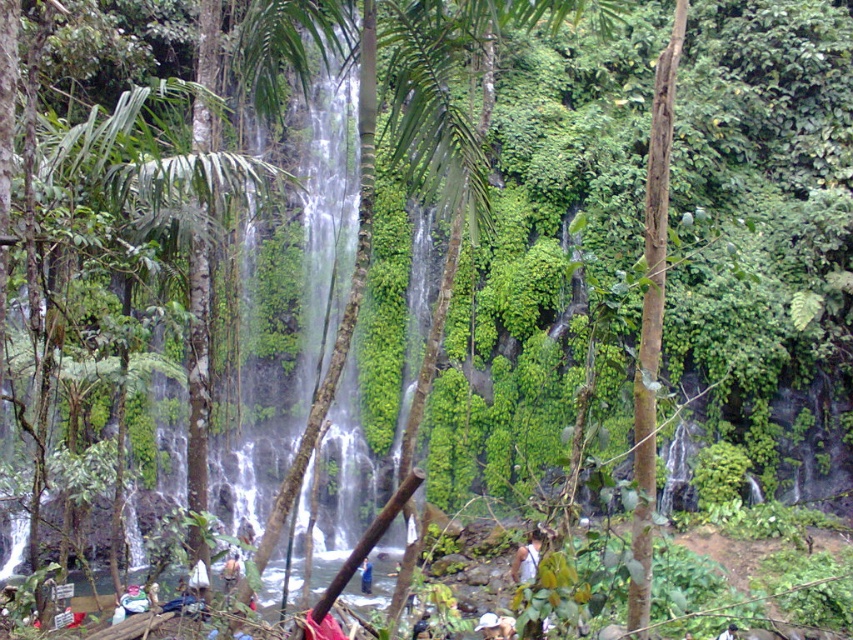
Looking at this image, you are a hiker who wants to cross the waterfall area. You see two pieces of fabric, the blue fabric at center and the dark blue fabric at lower right. Which one is larger in size?

The blue fabric at center is bigger than the dark blue fabric at lower right.

You are standing at the edge of the waterfall and see the blue fabric at center and the dark blue fabric at lower right. Which fabric is closer to you?

The blue fabric at center is closer to you because the dark blue fabric at lower right is positioned behind it.

You are a hiker who has just arrived at this tropical waterfall. You need to cross from the white fabric at center to the dark blue fabric at lower right. Given that your backpack has a width of 0.5 meters, can you safely walk straight between them without any obstacles?

The distance between the white fabric at center and dark blue fabric at lower right is 5.57 meters. Since your backpack is only 0.5 meters wide, there is ample space to walk straight between them without any issues.